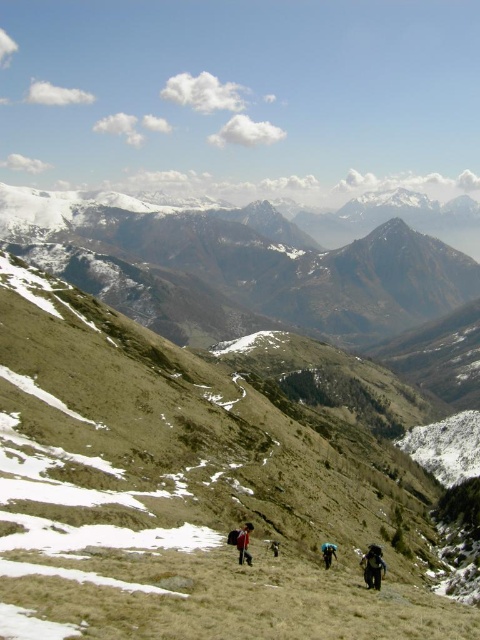
Does green grassy hillside at center appear on the right side of dark brown backpack at center?

Incorrect, green grassy hillside at center is not on the right side of dark brown backpack at center.

Who is positioned more to the right, green grassy hillside at center or dark brown backpack at center?

dark brown backpack at center is more to the right.

What are the coordinates of `green grassy hillside at center` in the screenshot? It's located at (192, 486).

Who is positioned more to the left, green grassy hillside at center or camouflage fabric backpack at center?

green grassy hillside at center is more to the left.

Between point (376, 460) and point (242, 540), which one is positioned in front?

Point (242, 540) is in front.

Where is `green grassy hillside at center`? The height and width of the screenshot is (640, 480). green grassy hillside at center is located at coordinates (192, 486).

Can you confirm if green grassy hillside at center is bigger than blue fabric backpack at center?

Correct, green grassy hillside at center is larger in size than blue fabric backpack at center.

Is the position of green grassy hillside at center less distant than that of blue fabric backpack at center?

Yes, it is.

Between point (392, 467) and point (328, 566), which one is positioned behind?

The point (392, 467) is behind.

In order to click on green grassy hillside at center in this screenshot , I will do `click(192, 486)`.